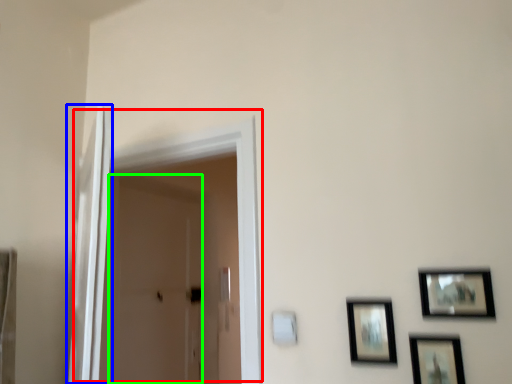
Question: Which is nearer to the door (highlighted by a red box)? screen door (highlighted by a blue box) or screen door (highlighted by a green box).

Choices:
 (A) screen door
 (B) screen door

Answer: (A)